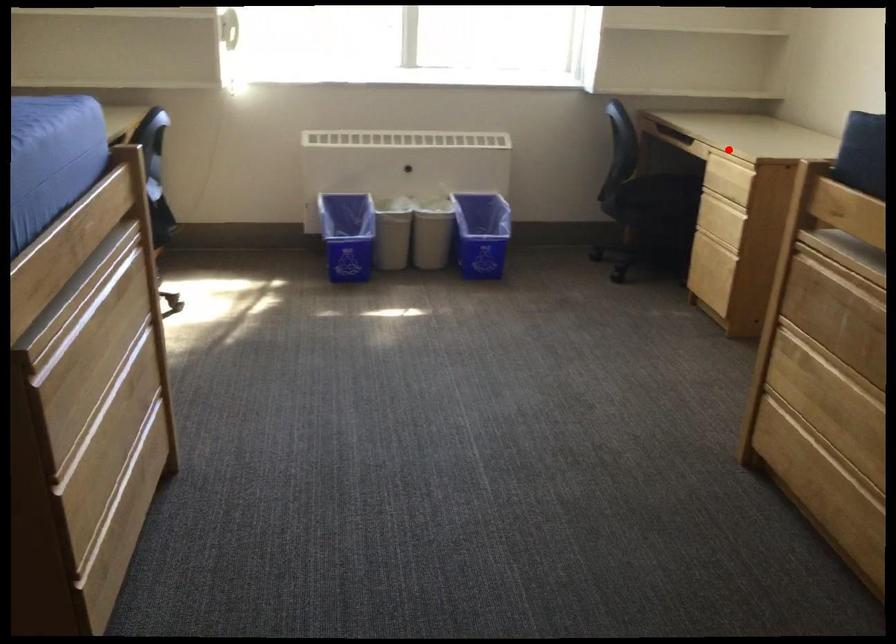
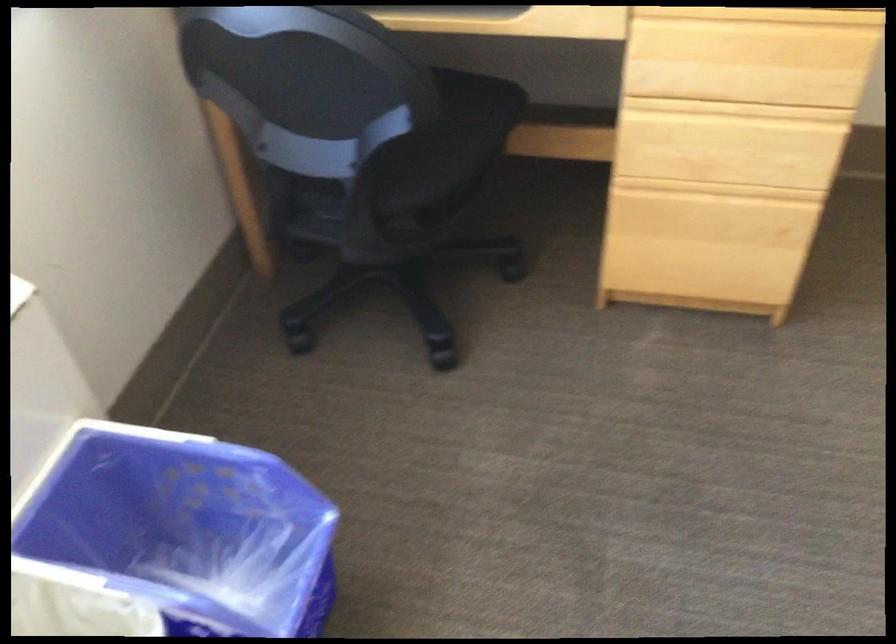
Where in the second image is the point corresponding to the highlighted location from the first image?

(768, 15)